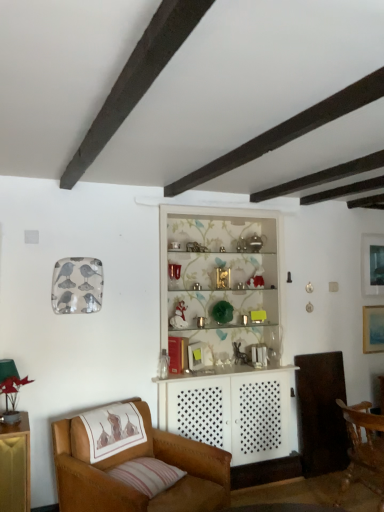
Question: Could you tell me if wooden chair at lower right, which is the 1th chair from right to left, is facing leather armchair at lower left, the second chair viewed from the right?

Choices:
 (A) yes
 (B) no

Answer: (B)

Question: Is wooden chair at lower right, which appears as the 2th chair when viewed from the left, beside leather armchair at lower left, the 1th chair viewed from the left?

Choices:
 (A) no
 (B) yes

Answer: (A)

Question: Is wooden chair at lower right, which appears as the 2th chair when viewed from the left, oriented away from leather armchair at lower left, the 1th chair viewed from the left?

Choices:
 (A) no
 (B) yes

Answer: (B)

Question: Considering the relative sizes of wooden chair at lower right, which appears as the 2th chair when viewed from the left, and leather armchair at lower left, the second chair viewed from the right, in the image provided, is wooden chair at lower right, which appears as the 2th chair when viewed from the left, wider than leather armchair at lower left, the second chair viewed from the right,?

Choices:
 (A) yes
 (B) no

Answer: (B)

Question: Is leather armchair at lower left, the 1th chair viewed from the left, a part of wooden chair at lower right, which appears as the 2th chair when viewed from the left?

Choices:
 (A) yes
 (B) no

Answer: (B)

Question: Is leather armchair at lower left, the 1th chair viewed from the left, wider or thinner than matte blue painting at upper right, the 2th picture frame when ordered from top to bottom?

Choices:
 (A) thin
 (B) wide

Answer: (B)

Question: Would you say leather armchair at lower left, the second chair viewed from the right, is to the left or to the right of matte blue painting at upper right, the first picture frame positioned from the bottom, in the picture?

Choices:
 (A) right
 (B) left

Answer: (B)

Question: From a real-world perspective, is leather armchair at lower left, the second chair viewed from the right, above or below matte blue painting at upper right, the 2th picture frame when ordered from top to bottom?

Choices:
 (A) below
 (B) above

Answer: (A)

Question: Does point (89, 499) appear closer or farther from the camera than point (374, 333)?

Choices:
 (A) farther
 (B) closer

Answer: (B)

Question: From the image's perspective, is matte blue painting at upper right, the 2th picture frame when ordered from top to bottom, above or below leather armchair at lower left, the 1th chair viewed from the left?

Choices:
 (A) below
 (B) above

Answer: (B)

Question: In terms of height, does matte blue painting at upper right, the first picture frame positioned from the bottom, look taller or shorter compared to leather armchair at lower left, the second chair viewed from the right?

Choices:
 (A) tall
 (B) short

Answer: (B)

Question: Looking at the image, does matte blue painting at upper right, the 2th picture frame when ordered from top to bottom, seem bigger or smaller compared to leather armchair at lower left, the second chair viewed from the right?

Choices:
 (A) big
 (B) small

Answer: (B)

Question: From a real-world perspective, relative to leather armchair at lower left, the second chair viewed from the right, is matte blue painting at upper right, the 2th picture frame when ordered from top to bottom, vertically above or below?

Choices:
 (A) above
 (B) below

Answer: (A)

Question: From a real-world perspective, is striped fabric pillow at lower left above or below wooden chair at lower right, which is the 1th chair from right to left?

Choices:
 (A) below
 (B) above

Answer: (B)

Question: In terms of width, does striped fabric pillow at lower left look wider or thinner when compared to wooden chair at lower right, which is the 1th chair from right to left?

Choices:
 (A) thin
 (B) wide

Answer: (A)